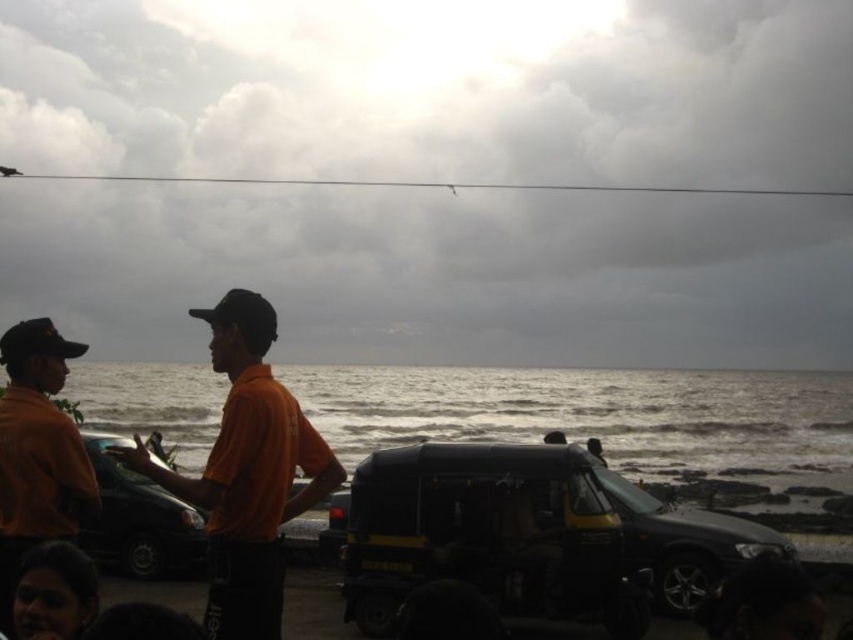
You are a pedestrian standing at the right edge of the scene. You want to cross the road to reach the black matte jeep at center and the shiny black car at left. Which vehicle should you approach first based on their positions?

The shiny black car at left is on the left side, so you should approach it first before moving to the black matte jeep at center which is positioned to its right.

You are standing at the center of the image and want to move towards the black matte jeep at center. Which direction should you go?

The black matte jeep at center is already at the center of the image, so you are already facing it. No need to change direction.

You are a photographer trying to capture a clear shot of the black matte jeep at center without any obstructions. Considering the orange fabric shirt at center is in the way, can you adjust your position to take the photo without moving the shirt?

The black matte jeep at center is not as tall as orange fabric shirt at center, so the orange fabric shirt at center may block the view of the jeep. To capture the jeep without moving the shirt, you could lower your camera angle or position yourself lower to avoid the obstruction caused by the taller shirt.